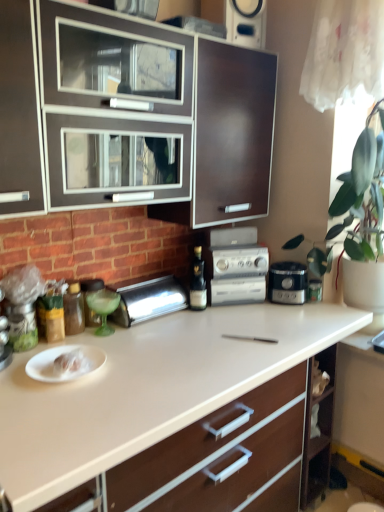
Identify the location of vacant area that is in front of white paper plate at lower left. (x=57, y=399).